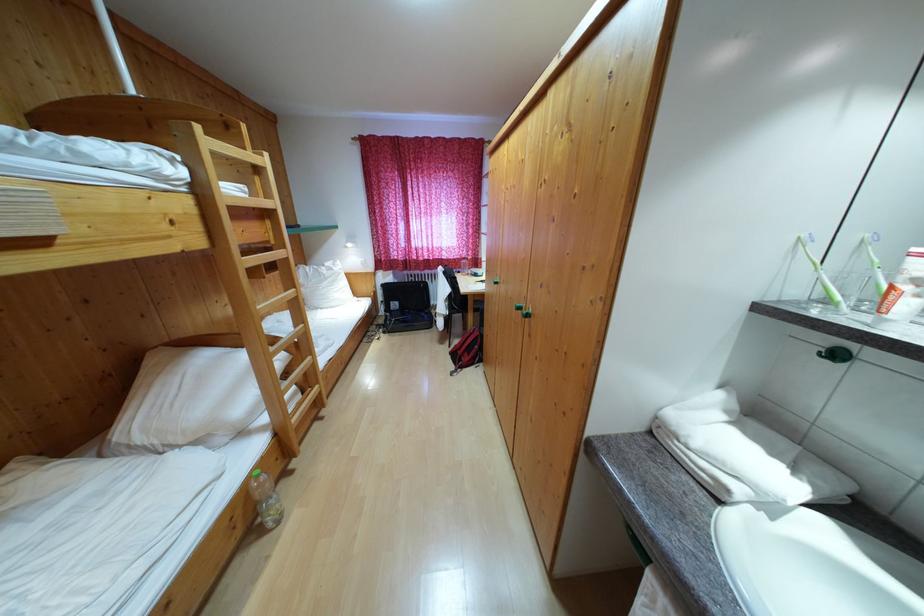
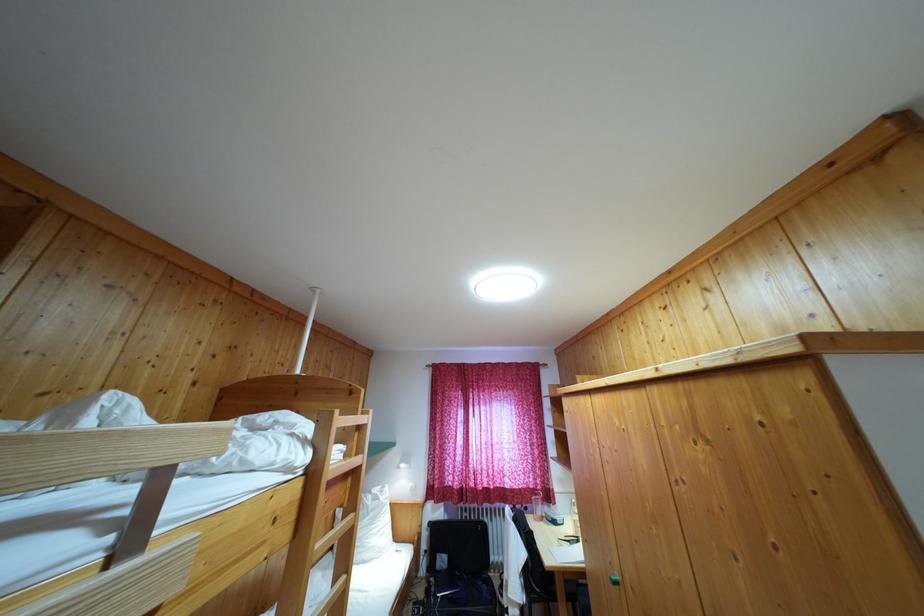
Find the pixel in the second image that matches (x=204, y=199) in the first image.

(317, 479)